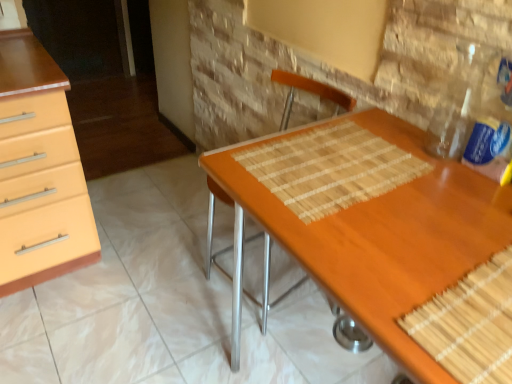
Locate an element on the screen. vacant region to the left of clear plastic bottle at upper right is located at coordinates (433, 180).